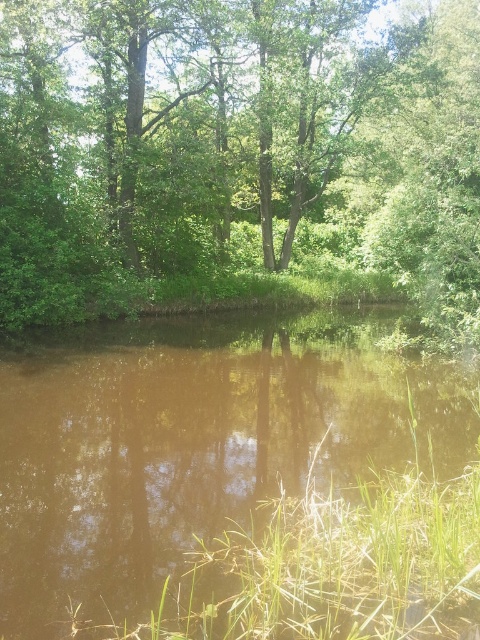
You are standing at the center of the image and want to walk towards the green leafy tree at center. In which direction should you move?

The green leafy tree at center is already at the center of the image, so you are already facing it. No need to move in any direction.

You are a bird looking for a place to land. You see the green leafy tree at center and the brown murky water at center. Which one is taller?

The green leafy tree at center is taller than the brown murky water at center, so you should land on the tree.

You are standing at the edge of the water in the scene. You see a point labeled as point (238, 154). What is located at that point?

The point (238, 154) indicates a green leafy tree at center.